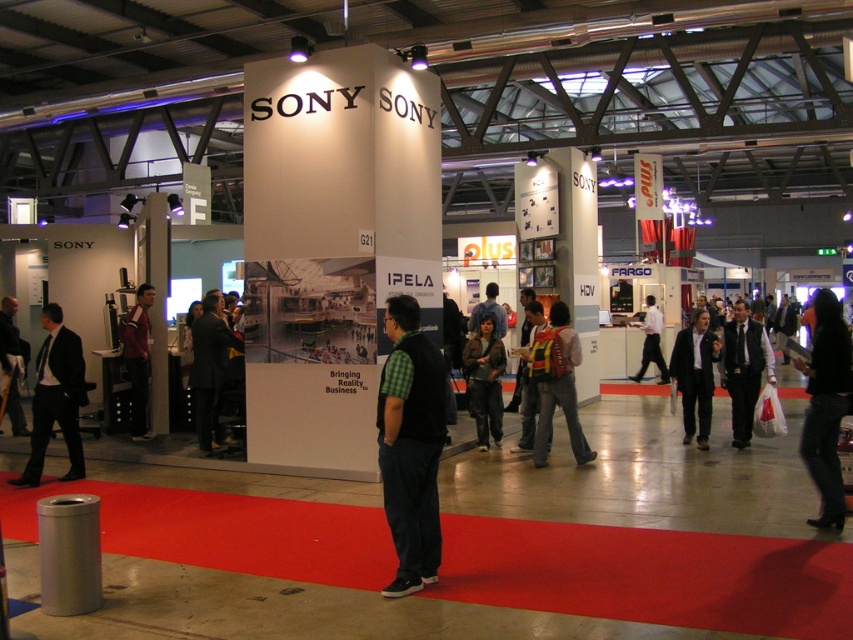
Between black fabric at right and yellow reflective vest at center, which one is positioned higher?

Positioned higher is black fabric at right.

Is point (833, 458) positioned after point (534, 401)?

No, (833, 458) is in front of (534, 401).

Does point (838, 308) come in front of point (549, 435)?

That is True.

This screenshot has width=853, height=640. I want to click on black fabric at right, so click(827, 404).

Looking at this image, is black suit at left to the right of matte black suit at center from the viewer's perspective?

No, black suit at left is not to the right of matte black suit at center.

Is black suit at left further to the viewer compared to matte black suit at center?

That is False.

Does point (67, 442) lie behind point (740, 380)?

No, (67, 442) is closer to viewer.

Identify the location of black suit at left. (56, 397).

Can you confirm if white shirt at center is thinner than black fabric jacket at center?

Yes.

Between point (654, 339) and point (776, 307), which one is positioned in front?

Point (654, 339)

Between point (657, 324) and point (784, 358), which one is positioned behind?

Point (784, 358)

Locate an element on the screen. The image size is (853, 640). white shirt at center is located at coordinates (651, 342).